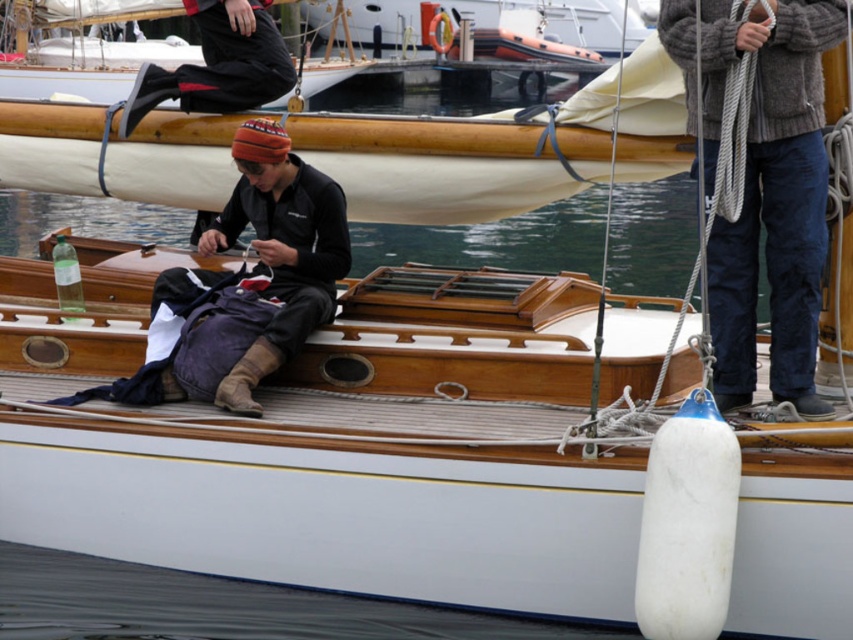
Question: Among these objects, which one is farthest from the camera?

Choices:
 (A) dark blue fabric backpack at center
 (B) knitted wool sweater at upper right

Answer: (A)

Question: Is knitted wool sweater at upper right thinner than dark blue fabric backpack at center?

Choices:
 (A) no
 (B) yes

Answer: (A)

Question: Is knitted wool sweater at upper right positioned at the back of dark blue fabric backpack at center?

Choices:
 (A) no
 (B) yes

Answer: (A)

Question: Does knitted wool sweater at upper right lie behind dark blue fabric backpack at center?

Choices:
 (A) yes
 (B) no

Answer: (B)

Question: Which of the following is the closest to the observer?

Choices:
 (A) knitted wool sweater at upper right
 (B) dark blue fabric backpack at center

Answer: (A)

Question: Which point is closer to the camera taking this photo?

Choices:
 (A) (256, 252)
 (B) (740, 365)

Answer: (B)